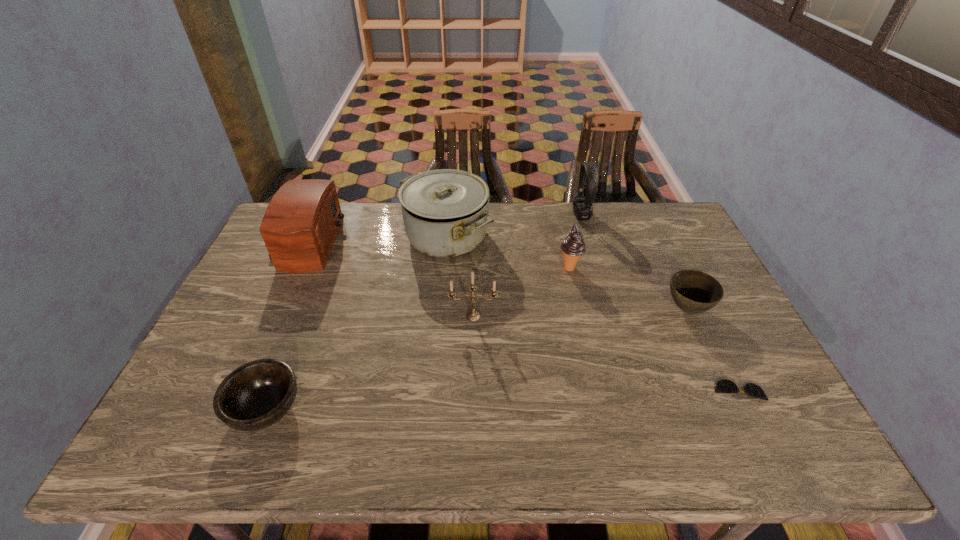
The image size is (960, 540). I want to click on vacant region that satisfies the following two spatial constraints: 1. on the front side of the saucepan; 2. on the left side of the right bowl, so click(x=441, y=309).

Image resolution: width=960 pixels, height=540 pixels. Identify the location of vacant space that satisfies the following two spatial constraints: 1. on the front-facing side of the shortest object; 2. on the right side of the sixth object from left to right. (632, 390).